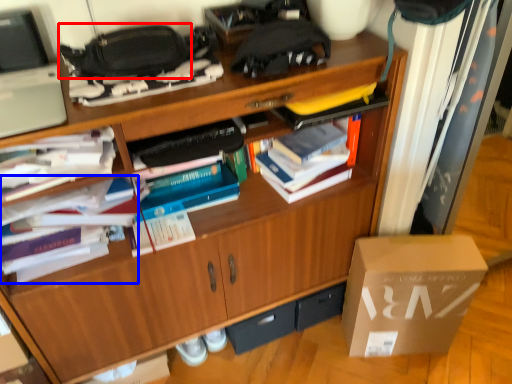
Question: Which object appears closest to the camera in this image, handbag (highlighted by a red box) or book (highlighted by a blue box)?

Choices:
 (A) handbag
 (B) book

Answer: (A)